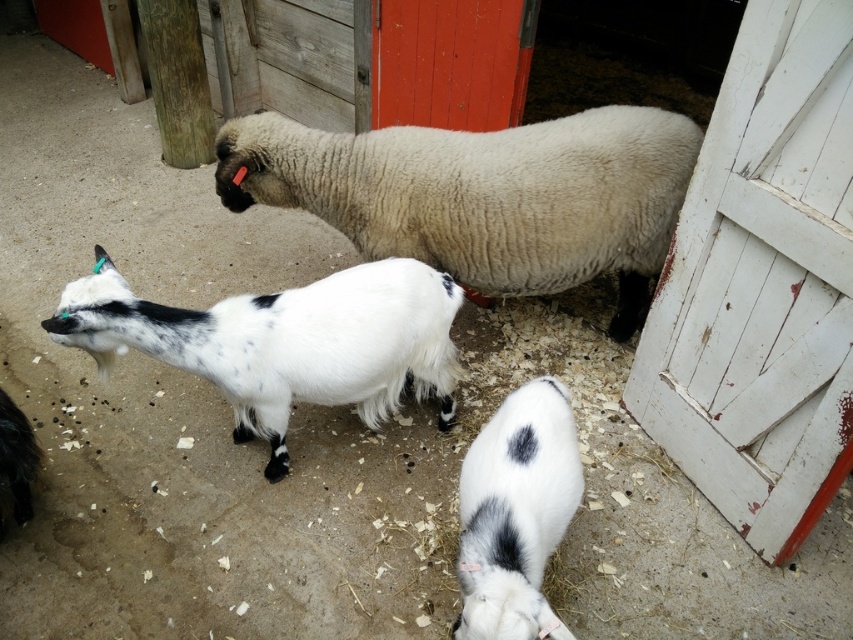
You are standing in the barnyard and see two points marked in the scene. Which point is closer to you, point [637,116] or point [492,589]?

Point [637,116] is further to the viewer than point [492,589], so the closer point to you is point [492,589].

You are standing in the barnyard and want to place a small fence between the two points, point (x=248, y=193) and point (x=354, y=364). Which point should the fence start closer to the camera?

The fence should start closer to point (x=248, y=193) because it is further to the camera than point (x=354, y=364).